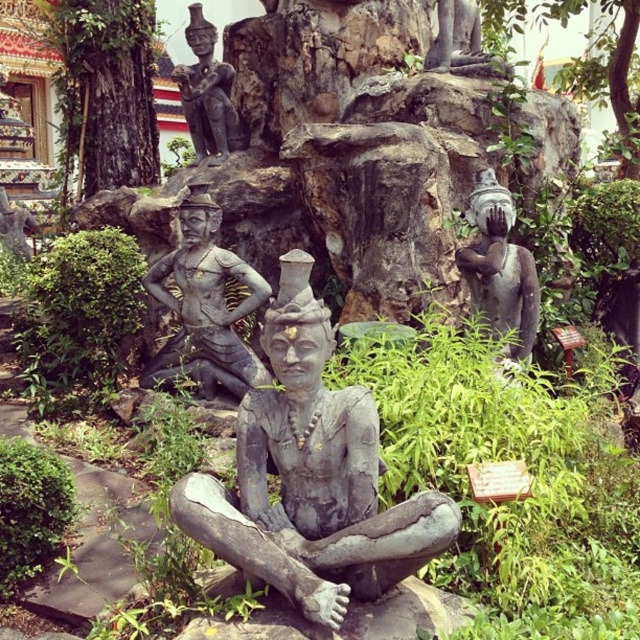
You are a visitor standing in front of the matte gray statue at right and the green leafy tree at upper right. Which object is taller?

The green leafy tree at upper right is taller than the matte gray statue at right.

You are standing at the center of the scene and want to locate the point at coordinates point [97,81]. Based on the description, where is this point located?

The point [97,81] is located on the green rough bark tree at upper left.

You are a bird looking for a place to perch. You see the green rough bark tree at upper left and the green leafy tree at upper right. Which tree is closer to the ground?

The green rough bark tree at upper left is positioned under the green leafy tree at upper right, so it is closer to the ground.